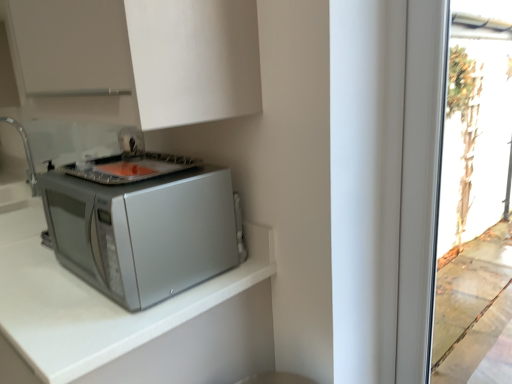
Question: Should I look upward or downward to see satin silver microwave at lower left?

Choices:
 (A) up
 (B) down

Answer: (B)

Question: Does silver matte microwave at lower left turn towards brushed metal sink at left?

Choices:
 (A) no
 (B) yes

Answer: (A)

Question: Is silver matte microwave at lower left thinner than brushed metal sink at left?

Choices:
 (A) yes
 (B) no

Answer: (B)

Question: Considering the relative sizes of silver matte microwave at lower left and brushed metal sink at left in the image provided, is silver matte microwave at lower left shorter than brushed metal sink at left?

Choices:
 (A) yes
 (B) no

Answer: (B)

Question: Is silver matte microwave at lower left wider than brushed metal sink at left?

Choices:
 (A) yes
 (B) no

Answer: (A)

Question: Considering the relative positions of silver matte microwave at lower left and brushed metal sink at left in the image provided, is silver matte microwave at lower left to the left of brushed metal sink at left from the viewer's perspective?

Choices:
 (A) yes
 (B) no

Answer: (B)

Question: Is silver matte microwave at lower left in contact with brushed metal sink at left?

Choices:
 (A) yes
 (B) no

Answer: (B)

Question: Does brushed metal sink at left have a greater height compared to silver matte microwave at lower left?

Choices:
 (A) yes
 (B) no

Answer: (B)

Question: Can you confirm if brushed metal sink at left is shorter than silver matte microwave at lower left?

Choices:
 (A) no
 (B) yes

Answer: (B)

Question: From the image's perspective, is brushed metal sink at left beneath silver matte microwave at lower left?

Choices:
 (A) no
 (B) yes

Answer: (A)

Question: Can you confirm if brushed metal sink at left is thinner than silver matte microwave at lower left?

Choices:
 (A) no
 (B) yes

Answer: (B)

Question: Is brushed metal sink at left positioned beyond the bounds of silver matte microwave at lower left?

Choices:
 (A) no
 (B) yes

Answer: (B)

Question: Does brushed metal sink at left turn towards silver matte microwave at lower left?

Choices:
 (A) no
 (B) yes

Answer: (A)

Question: Are white matte cabinet at upper center and brushed metal sink at left far apart?

Choices:
 (A) yes
 (B) no

Answer: (A)